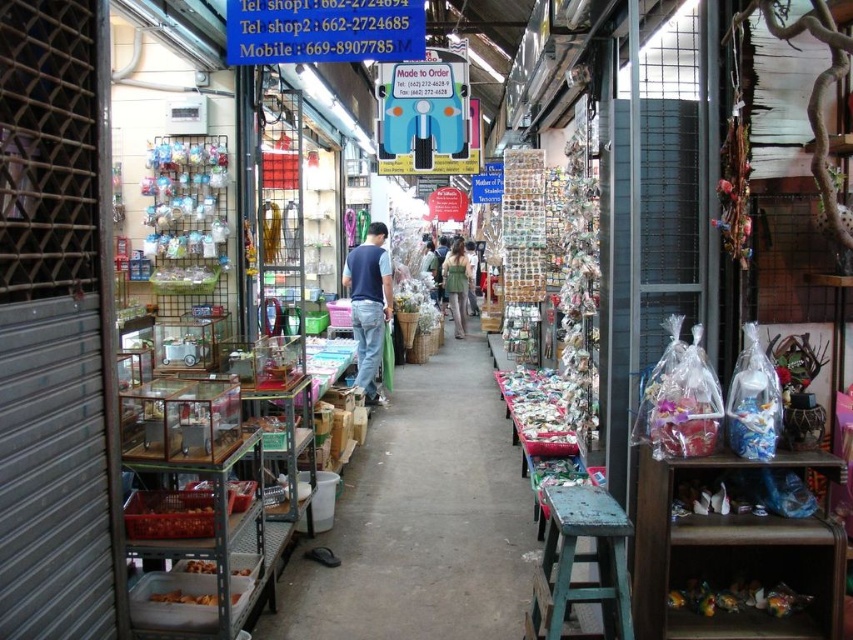
Is point (401, 504) in front of point (732, 584)?

No.

Is the position of metallic silver shelves at center less distant than that of translucent plastic food at lower right?

No.

The width and height of the screenshot is (853, 640). Identify the location of metallic silver shelves at center. (422, 518).

Find the location of a particular element. metallic silver shelves at center is located at coordinates (422, 518).

Can you confirm if green fabric dress at center is positioned below translucent plastic food at lower left?

Actually, green fabric dress at center is above translucent plastic food at lower left.

Is point (456, 269) in front of point (175, 602)?

No.

Where is `green fabric dress at center`? This screenshot has height=640, width=853. green fabric dress at center is located at coordinates (457, 284).

Where is `green fabric dress at center`? The height and width of the screenshot is (640, 853). green fabric dress at center is located at coordinates (457, 284).

Does wooden stool at center come in front of translucent plastic candy at center?

Yes, wooden stool at center is in front of translucent plastic candy at center.

Can you confirm if wooden stool at center is wider than translucent plastic candy at center?

No.

Which is in front, point (546, 628) or point (550, 390)?

Positioned in front is point (546, 628).

At what (x,y) coordinates should I click in order to perform the action: click on wooden stool at center. Please return your answer as a coordinate pair (x, y). Looking at the image, I should click on (581, 563).